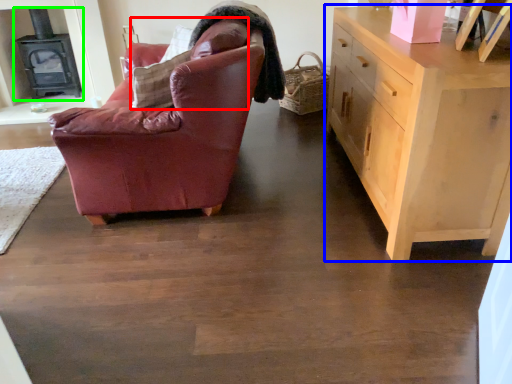
Question: Which is nearer to the pillow (highlighted by a red box)? chest of drawers (highlighted by a blue box) or fireplace (highlighted by a green box).

Choices:
 (A) chest of drawers
 (B) fireplace

Answer: (A)